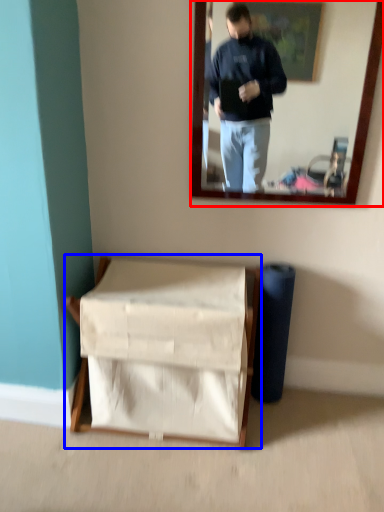
Question: Which of the following is the farthest to the observer, mirror (highlighted by a red box) or furniture (highlighted by a blue box)?

Choices:
 (A) mirror
 (B) furniture

Answer: (B)